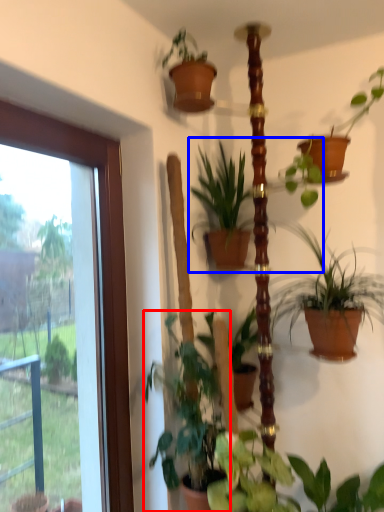
Question: Which object appears closest to the camera in this image, houseplant (highlighted by a red box) or houseplant (highlighted by a blue box)?

Choices:
 (A) houseplant
 (B) houseplant

Answer: (A)